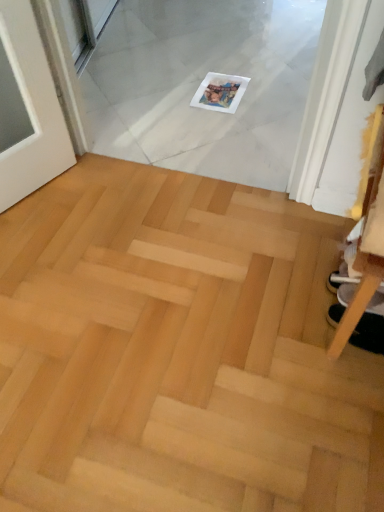
Question: From the image's perspective, is natural wood parquet floor at center located above or below white fabric shoe at lower right?

Choices:
 (A) above
 (B) below

Answer: (B)

Question: Would you say natural wood parquet floor at center is inside or outside white fabric shoe at lower right?

Choices:
 (A) outside
 (B) inside

Answer: (A)

Question: Based on their positions, is natural wood parquet floor at center located to the left or right of white fabric shoe at lower right?

Choices:
 (A) left
 (B) right

Answer: (A)

Question: Looking at their shapes, would you say white fabric shoe at lower right is wider or thinner than natural wood parquet floor at center?

Choices:
 (A) thin
 (B) wide

Answer: (A)

Question: Is white fabric shoe at lower right inside the boundaries of natural wood parquet floor at center, or outside?

Choices:
 (A) outside
 (B) inside

Answer: (A)

Question: From a real-world perspective, is white fabric shoe at lower right positioned above or below natural wood parquet floor at center?

Choices:
 (A) above
 (B) below

Answer: (A)

Question: Considering the positions of white fabric shoe at lower right and natural wood parquet floor at center in the image, is white fabric shoe at lower right taller or shorter than natural wood parquet floor at center?

Choices:
 (A) tall
 (B) short

Answer: (A)